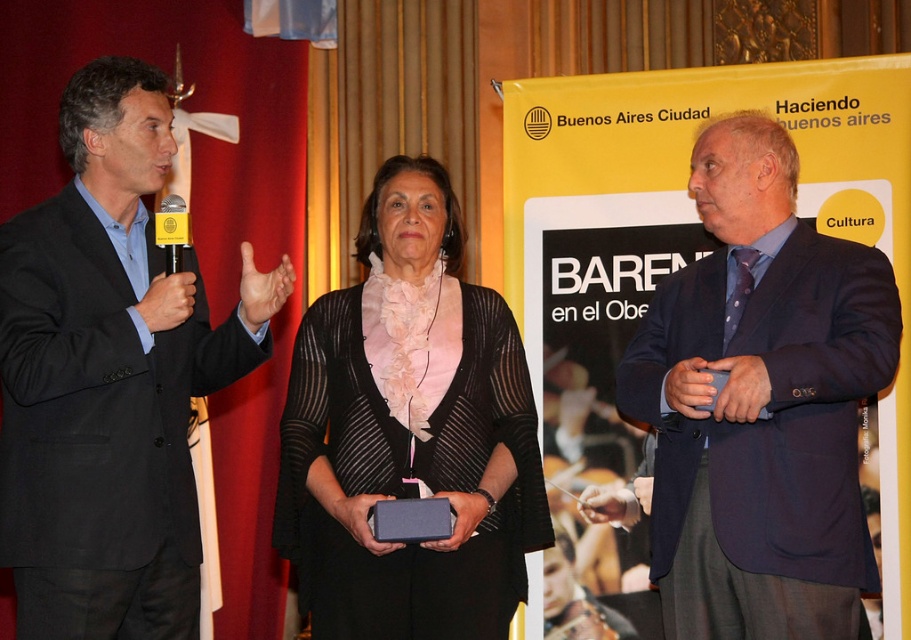
Question: Can you confirm if black suit at left is smaller than matte black sweater at center?

Choices:
 (A) no
 (B) yes

Answer: (A)

Question: Is the position of black suit at left more distant than that of dark blue suit at center?

Choices:
 (A) no
 (B) yes

Answer: (A)

Question: Based on their relative distances, which object is farther from the yellow plastic microphone at left?

Choices:
 (A) black suit at left
 (B) dark blue suit at center

Answer: (B)

Question: Estimate the real-world distances between objects in this image. Which object is closer to the dark blue suit at center?

Choices:
 (A) matte black sweater at center
 (B) black suit at left

Answer: (A)

Question: Which object is closer to the camera taking this photo?

Choices:
 (A) matte black sweater at center
 (B) black suit at left
 (C) yellow plastic microphone at left
 (D) dark blue suit at center

Answer: (B)

Question: Is dark blue suit at center to the left of yellow plastic microphone at left from the viewer's perspective?

Choices:
 (A) yes
 (B) no

Answer: (B)